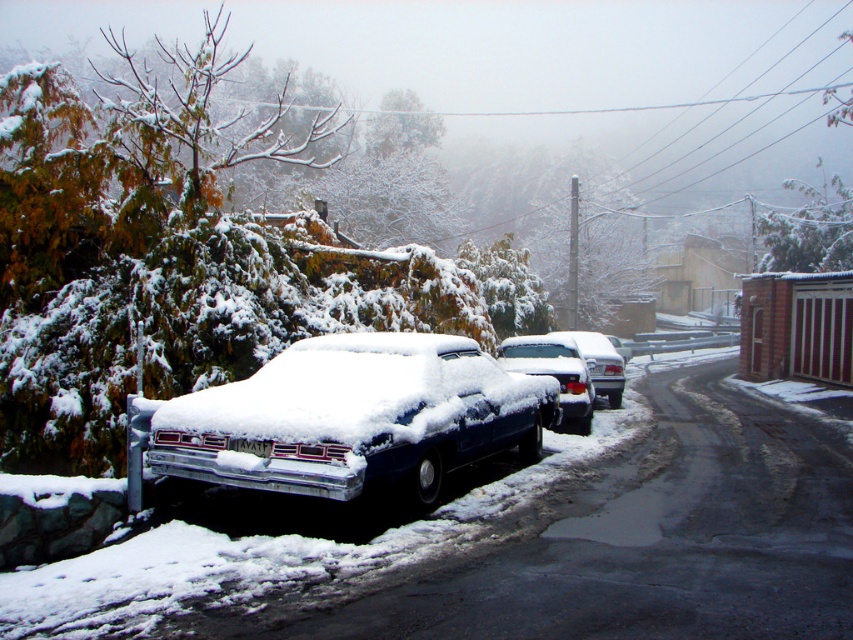
Who is positioned more to the right, sleek blue car at center or snow-covered sedan at center?

snow-covered sedan at center is more to the right.

The width and height of the screenshot is (853, 640). Find the location of `sleek blue car at center`. sleek blue car at center is located at coordinates (355, 417).

Measure the distance between sleek blue car at center and white plastic license plate at center.

They are 1.68 meters apart.

Is sleek blue car at center shorter than white plastic license plate at center?

In fact, sleek blue car at center may be taller than white plastic license plate at center.

Who is more forward, (373, 362) or (268, 442)?

Point (268, 442)

At what (x,y) coordinates should I click in order to perform the action: click on sleek blue car at center. Please return your answer as a coordinate pair (x, y). This screenshot has width=853, height=640. Looking at the image, I should click on (355, 417).

Who is shorter, snow-covered sedan at center or white plastic license plate at center?

Standing shorter between the two is white plastic license plate at center.

Between point (599, 337) and point (265, 451), which one is positioned in front?

Point (265, 451) is more forward.

Who is more distant from viewer, (x=602, y=392) or (x=265, y=445)?

The point (x=602, y=392) is behind.

Locate an element on the screen. snow-covered sedan at center is located at coordinates (601, 364).